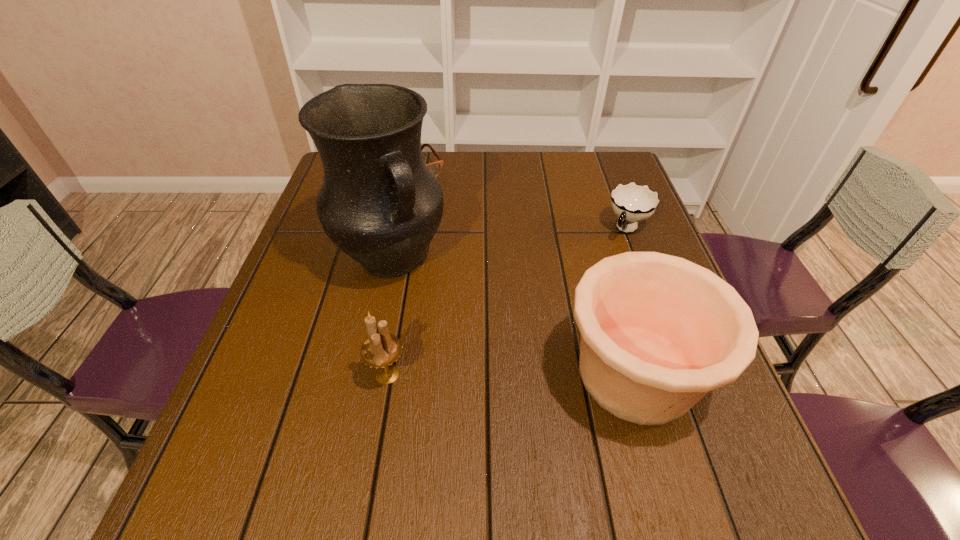
Find the location of `pitcher that is at the left edge`. pitcher that is at the left edge is located at coordinates (379, 203).

Where is `pottery located in the right edge section of the desktop`? This screenshot has width=960, height=540. pottery located in the right edge section of the desktop is located at coordinates (658, 332).

Where is `cup located in the right edge section of the desktop`? The image size is (960, 540). cup located in the right edge section of the desktop is located at coordinates (632, 203).

Locate an element on the screen. This screenshot has height=540, width=960. object that is at the far left corner is located at coordinates (435, 167).

The image size is (960, 540). I want to click on object located at the near right corner, so click(x=658, y=332).

The height and width of the screenshot is (540, 960). I want to click on vacant space at the far edge of the desktop, so click(524, 159).

You are a GUI agent. You are given a task and a screenshot of the screen. Output one action in this format:
    pyautogui.click(x=<x>, y=<y>)
    Task: Click on the vacant space at the near edge of the desktop
    
    Given the screenshot: What is the action you would take?
    (395, 448)

In the image, there is a desktop. In order to click on vacant region at the left edge in this screenshot , I will do `click(250, 379)`.

In the image, there is a desktop. At what (x,y) coordinates should I click in order to perform the action: click on vacant space at the right edge. Please return your answer as a coordinate pair (x, y). Image resolution: width=960 pixels, height=540 pixels. Looking at the image, I should click on (721, 395).

In order to click on vacant space at the near left corner of the desktop in this screenshot , I will do `click(300, 426)`.